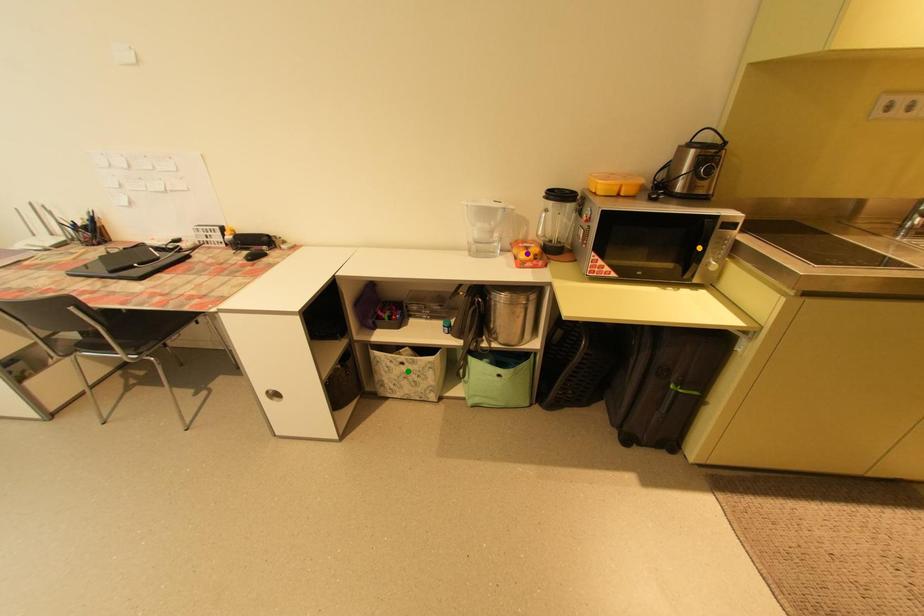
Order these from farthest to nearest:
orange point
purple point
green point

green point < purple point < orange point